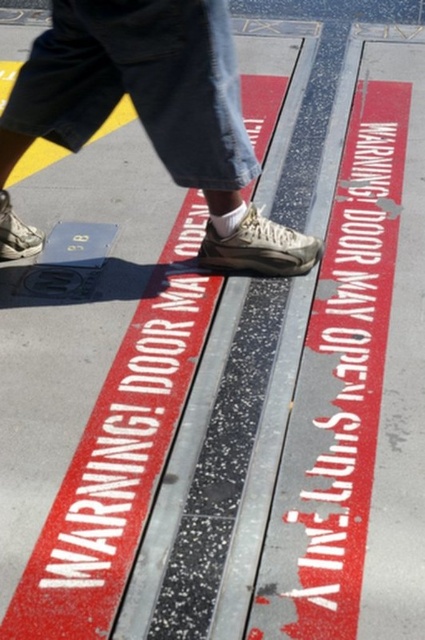
You are a delivery person carrying a heavy box and need to step onto the tactile warning strip. Your matte gray sneakers at center are currently 5.88 feet away from the strip. Can you safely step onto the strip without moving closer?

The matte gray sneakers at center are 5.88 feet away from the camera, but the distance to the strip isn not specified. Therefore, it is unclear if you can safely step onto the strip without moving closer.

You are a visually impaired person using a cane to navigate. You feel the matte gray sneakers at center and the white painted text at center under your cane. Which object takes up more space on the ground?

The white painted text at center takes up more space on the ground than the matte gray sneakers at center because the matte gray sneakers at center occupies less space than white painted text at center.